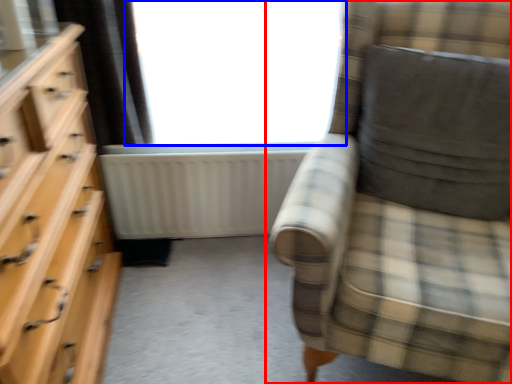
Question: Among these objects, which one is nearest to the camera, chair (highlighted by a red box) or window (highlighted by a blue box)?

Choices:
 (A) chair
 (B) window

Answer: (A)